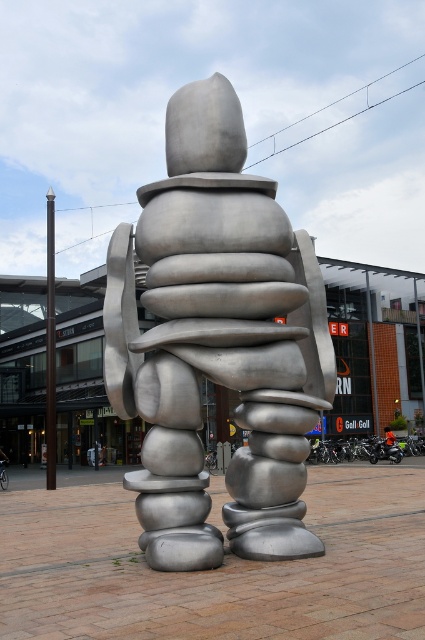
Does brushed metal mall at center appear on the left side of orange fabric jacket at center?

Yes, brushed metal mall at center is to the left of orange fabric jacket at center.

Is point (14, 404) positioned in front of point (393, 449)?

No, (14, 404) is further to viewer.

Where is `brushed metal mall at center`? The height and width of the screenshot is (640, 425). brushed metal mall at center is located at coordinates (373, 342).

Which is behind, point (144, 385) or point (393, 442)?

The point (393, 442) is more distant.

Which is behind, point (186, 186) or point (387, 444)?

The point (387, 444) is behind.

Where is `brushed metal sculpture at center`? This screenshot has width=425, height=640. brushed metal sculpture at center is located at coordinates (218, 342).

Is brushed metal sculpture at center thinner than brushed metal mall at center?

Yes.

Does point (161, 538) lie in front of point (37, 424)?

Yes.

The width and height of the screenshot is (425, 640). I want to click on brushed metal sculpture at center, so click(218, 342).